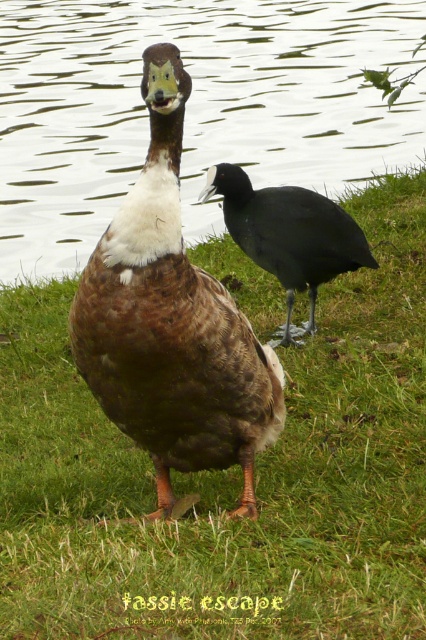
Question: Is brown matte duck at center below shiny black bird at center?

Choices:
 (A) yes
 (B) no

Answer: (A)

Question: Can you confirm if glossy water at center is bigger than brown matte duck at center?

Choices:
 (A) no
 (B) yes

Answer: (A)

Question: Which is nearer to the shiny black bird at center?

Choices:
 (A) brown matte duck at center
 (B) glossy water at center

Answer: (A)

Question: Does brown matte duck at center appear over shiny black bird at center?

Choices:
 (A) no
 (B) yes

Answer: (A)

Question: Which point is closer to the camera taking this photo?

Choices:
 (A) (397, 100)
 (B) (149, 257)

Answer: (B)

Question: Which object is closer to the camera taking this photo?

Choices:
 (A) glossy water at center
 (B) brown matte duck at center

Answer: (B)